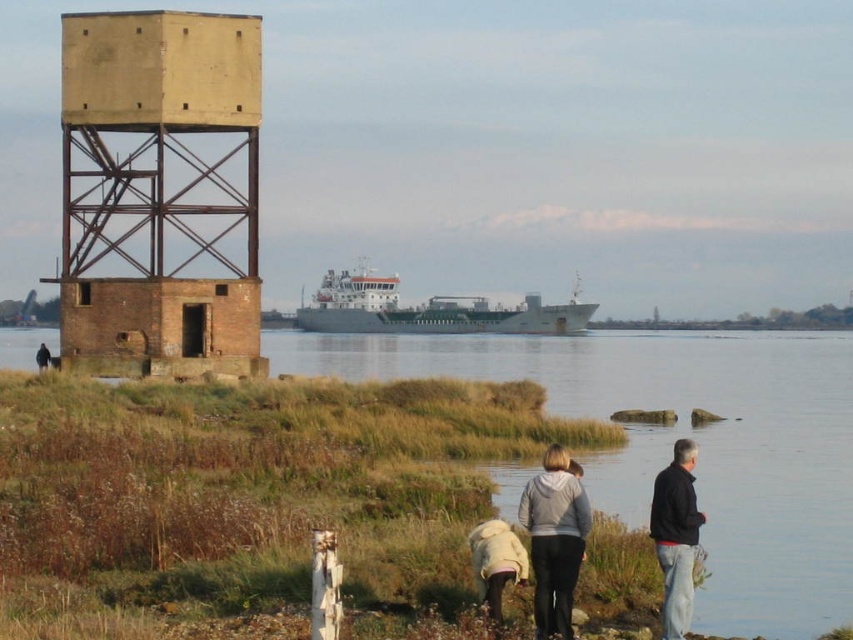
Which of these two, gray matte cargo ship at center or dark brown leather jacket at lower left, stands taller?

gray matte cargo ship at center

Is point (378, 324) positioned before point (44, 346)?

No, it is behind (44, 346).

You are a GUI agent. You are given a task and a screenshot of the screen. Output one action in this format:
    pyautogui.click(x=<x>, y=<y>)
    Task: Click on the gray matte cargo ship at center
    
    Given the screenshot: What is the action you would take?
    pyautogui.click(x=430, y=310)

Consider the image. Can you confirm if dark blue jacket at lower right is positioned below dark brown leather jacket at lower left?

Yes.

How far apart are dark blue jacket at lower right and dark brown leather jacket at lower left?

dark blue jacket at lower right is 57.09 meters away from dark brown leather jacket at lower left.

Which is behind, point (676, 525) or point (39, 369)?

The point (39, 369) is more distant.

Where is `dark blue jacket at lower right`? dark blue jacket at lower right is located at coordinates [x=676, y=536].

Based on the photo, which is above, light gray hoodie at lower center or dark blue jacket at lower right?

light gray hoodie at lower center

Is light gray hoodie at lower center smaller than dark blue jacket at lower right?

Yes.

Is point (538, 481) positioned after point (689, 467)?

No, (538, 481) is in front of (689, 467).

I want to click on light gray hoodie at lower center, so click(553, 541).